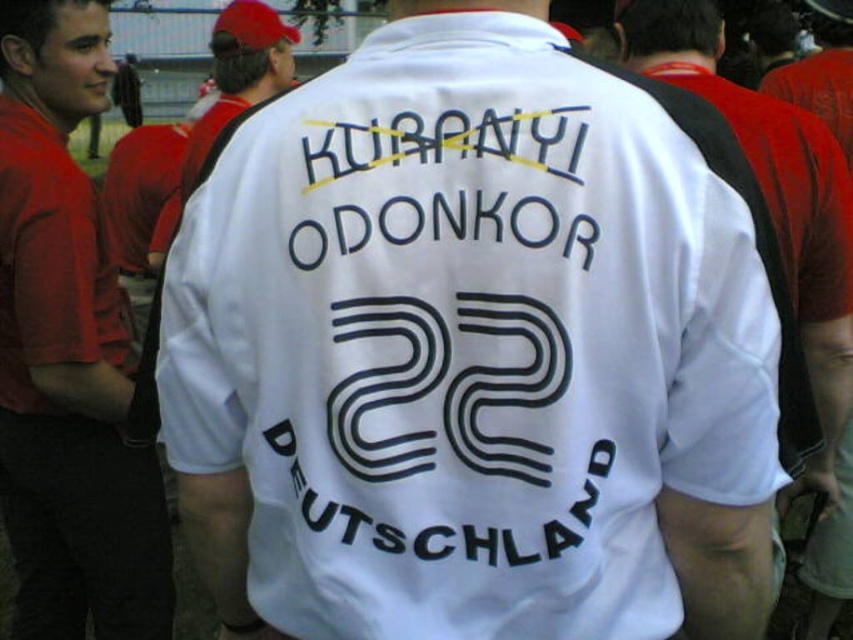
Is black printed text at center bigger than white jersey at center?

Incorrect, black printed text at center is not larger than white jersey at center.

Which is above, black printed text at center or white jersey at center?

white jersey at center

Locate an element on the screen. The height and width of the screenshot is (640, 853). black printed text at center is located at coordinates (440, 332).

Find the location of a particular element. black printed text at center is located at coordinates (440, 332).

Is black printed text at center closer to the viewer compared to black text at center?

Yes, black printed text at center is in front of black text at center.

Between point (358, 282) and point (399, 243), which one is positioned behind?

Positioned behind is point (358, 282).

Find the location of a particular element. black printed text at center is located at coordinates (440, 332).

Looking at this image, between black text at center and white jersey at center, which one appears on the left side from the viewer's perspective?

From the viewer's perspective, black text at center appears more on the left side.

The width and height of the screenshot is (853, 640). Describe the element at coordinates (442, 180) in the screenshot. I see `black text at center` at that location.

Where is `black text at center`? The width and height of the screenshot is (853, 640). black text at center is located at coordinates (442, 180).